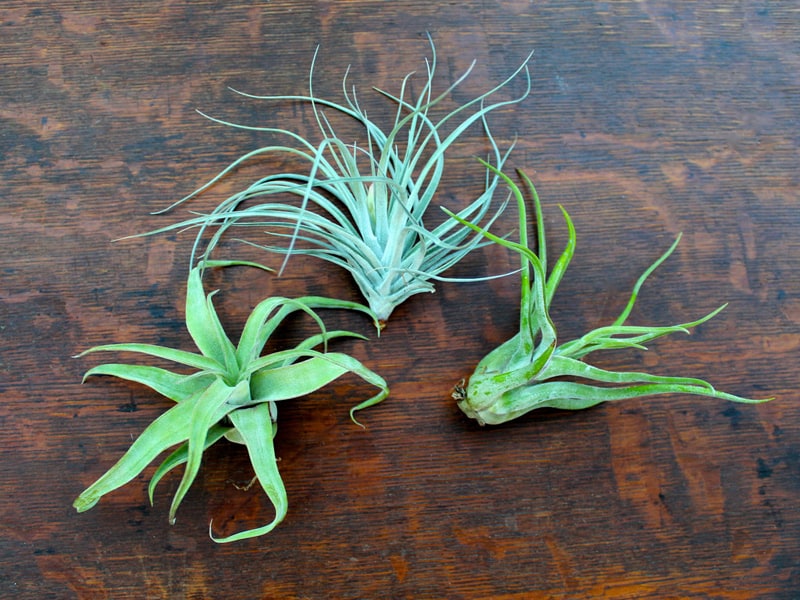
The image size is (800, 600). Identify the location of oak tabletop. (654, 197).